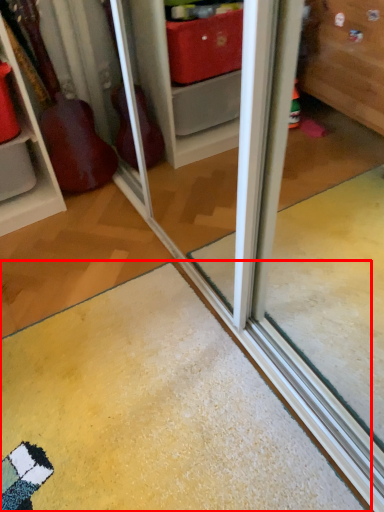
Question: Considering the relative positions of doormat (annotated by the red box) and shelf in the image provided, where is doormat (annotated by the red box) located with respect to the staircase?

Choices:
 (A) left
 (B) right

Answer: (B)